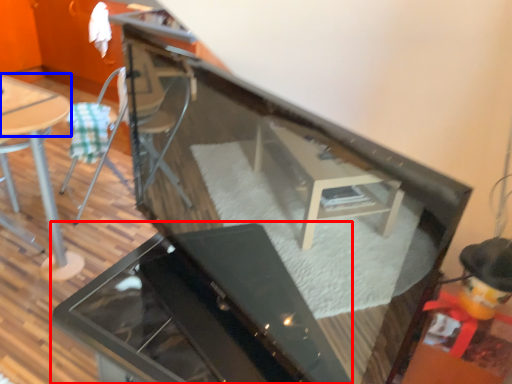
Question: Which point is closer to the camera, grill (highlighted by a red box) or table top (highlighted by a blue box)?

Choices:
 (A) grill
 (B) table top

Answer: (A)